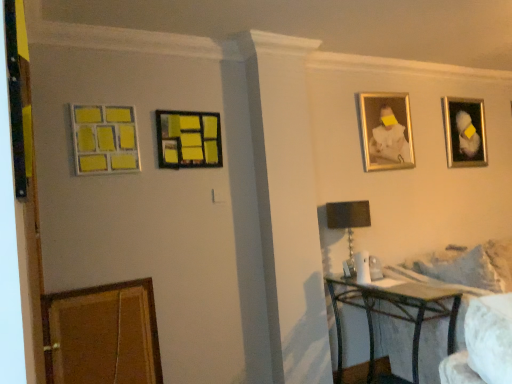
What do you see at coordinates (464, 132) in the screenshot? I see `metallic silver picture frame at upper right, which is the 1th picture frame in back-to-front order` at bounding box center [464, 132].

Find the location of a particular element. metallic silver picture frame at upper right, which is the 1th picture frame in back-to-front order is located at coordinates (464, 132).

You are a GUI agent. You are given a task and a screenshot of the screen. Output one action in this format:
    pyautogui.click(x=<x>, y=<y>)
    Task: Click on the yellow matte picture frame at upper left, marked as the first picture frame in a front-to-back arrangement
    
    Given the screenshot: What is the action you would take?
    pyautogui.click(x=104, y=139)

Measure the distance between point (430, 280) and camera.

Point (430, 280) is 8.24 feet from camera.

This screenshot has width=512, height=384. Identify the location of matte black table lamp at lower right. (348, 224).

This screenshot has width=512, height=384. What do you see at coordinates (394, 313) in the screenshot?
I see `metallic black table at lower right` at bounding box center [394, 313].

Locate an element on the screen. Image resolution: width=512 pixels, height=384 pixels. metallic silver picture frame at upper right, which ranks as the 4th picture frame in left-to-right order is located at coordinates (464, 132).

The width and height of the screenshot is (512, 384). I want to click on table that appears below the white fluffy pillow at right (from a real-world perspective), so click(394, 313).

From a real-world perspective, who is located higher, metallic black table at lower right or white fluffy pillow at right?

white fluffy pillow at right is physically above.

Between metallic black table at lower right and white fluffy pillow at right, which one has smaller size?

With smaller size is white fluffy pillow at right.

Can you confirm if metallic black table at lower right is positioned to the right of white fluffy pillow at right?

No.

Looking at this image, is white fabric couch at lower right aimed at white fluffy pillow at right?

Yes.

Identify the location of pillow that is under the white fabric couch at lower right (from a real-world perspective). (501, 259).

Can you tell me how much white fabric couch at lower right and white fluffy pillow at right differ in facing direction?

The facing directions of white fabric couch at lower right and white fluffy pillow at right are 83.3 degrees apart.

Does point (458, 348) appear closer or farther from the camera than point (492, 240)?

Point (458, 348) appears to be closer to the viewer than point (492, 240).

From their relative heights in the image, would you say white fabric couch at lower right is taller or shorter than metallic silver picture frame at upper right, which is the 1th picture frame in back-to-front order?

In the image, white fabric couch at lower right appears to be shorter than metallic silver picture frame at upper right, which is the 1th picture frame in back-to-front order.

Choose the correct answer: Is white fabric couch at lower right inside metallic silver picture frame at upper right, the 1th picture frame positioned from the right, or outside it?

The correct answer is: outside.

Is white fabric couch at lower right beside metallic silver picture frame at upper right, which ranks as the 4th picture frame in left-to-right order?

white fabric couch at lower right and metallic silver picture frame at upper right, which ranks as the 4th picture frame in left-to-right order, are clearly separated.

Consider the image. Which is more distant, (486, 258) or (465, 153)?

The point (465, 153) is farther from the camera.

Does white fluffy pillow at right have a lesser height compared to metallic silver picture frame at upper right, which is the 1th picture frame in back-to-front order?

Correct, white fluffy pillow at right is not as tall as metallic silver picture frame at upper right, which is the 1th picture frame in back-to-front order.

Is white fluffy pillow at right to the left of metallic silver picture frame at upper right, the 1th picture frame positioned from the right, from the viewer's perspective?

No.

Is point (496, 263) positioned before point (471, 159)?

Yes, point (496, 263) is closer to viewer.

In terms of width, does white fluffy pillow at right look wider or thinner when compared to metallic silver picture frame at upper right, which ranks as the 4th picture frame in left-to-right order?

Considering their sizes, white fluffy pillow at right looks broader than metallic silver picture frame at upper right, which ranks as the 4th picture frame in left-to-right order.

Is matte plastic picture frame at center, which is the third picture frame from back to front, inside the boundaries of metallic black table at lower right, or outside?

matte plastic picture frame at center, which is the third picture frame from back to front, is not enclosed by metallic black table at lower right.

Can you confirm if matte plastic picture frame at center, which is the third picture frame from back to front, is smaller than metallic black table at lower right?

Indeed, matte plastic picture frame at center, which is the third picture frame from back to front, has a smaller size compared to metallic black table at lower right.

Is matte plastic picture frame at center, positioned as the 2th picture frame in front-to-back order, in contact with metallic black table at lower right?

matte plastic picture frame at center, positioned as the 2th picture frame in front-to-back order, is not next to metallic black table at lower right, and they're not touching.

Does metallic silver picture frame at upper right, the 1th picture frame positioned from the right, have a smaller size compared to gold metallic picture frame at upper right, the 2th picture frame viewed from the right?

No.

Is metallic silver picture frame at upper right, the 1th picture frame positioned from the right, not close to gold metallic picture frame at upper right, the third picture frame positioned from the front?

No, metallic silver picture frame at upper right, the 1th picture frame positioned from the right, is not far from gold metallic picture frame at upper right, the third picture frame positioned from the front.

Consider the image. From the image's perspective, is metallic silver picture frame at upper right, which ranks as the 4th picture frame in left-to-right order, located above or below gold metallic picture frame at upper right, the 2th picture frame viewed from the right?

From the image's perspective, metallic silver picture frame at upper right, which ranks as the 4th picture frame in left-to-right order, appears above gold metallic picture frame at upper right, the 2th picture frame viewed from the right.

Between metallic black table at lower right and metallic silver picture frame at upper right, which ranks as the 4th picture frame in left-to-right order, which one appears on the left side from the viewer's perspective?

metallic black table at lower right is more to the left.

Is metallic black table at lower right inside or outside of metallic silver picture frame at upper right, which is the fourth picture frame in front-to-back order?

The correct answer is: outside.

From the image's perspective, which object appears higher, metallic black table at lower right or metallic silver picture frame at upper right, which is the fourth picture frame in front-to-back order?

metallic silver picture frame at upper right, which is the fourth picture frame in front-to-back order, from the image's perspective.

Who is bigger, metallic black table at lower right or metallic silver picture frame at upper right, the 1th picture frame positioned from the right?

metallic black table at lower right.

The width and height of the screenshot is (512, 384). In order to click on table below the white fluffy pillow at right (from the image's perspective) in this screenshot , I will do [394, 313].

Locate an element on the screen. The image size is (512, 384). pillow located underneath the white fabric couch at lower right (from a real-world perspective) is located at coordinates (501, 259).

Considering their positions, is metallic black table at lower right positioned closer to matte black table lamp at lower right than yellow matte picture frame at upper left, which is the 4th picture frame from right to left?

Among the two, metallic black table at lower right is located nearer to matte black table lamp at lower right.

From the image, which object appears to be nearer to matte black table lamp at lower right, matte plastic picture frame at center, positioned as the 2th picture frame in front-to-back order, or gold metallic picture frame at upper right, the third picture frame positioned from the front?

gold metallic picture frame at upper right, the third picture frame positioned from the front, lies closer to matte black table lamp at lower right than the other object.

Based on their spatial positions, is matte black table lamp at lower right or yellow matte picture frame at upper left, which is the 1th picture frame from left to right, further from gold metallic picture frame at upper right, the third picture frame positioned from the front?

Based on the image, yellow matte picture frame at upper left, which is the 1th picture frame from left to right, appears to be further to gold metallic picture frame at upper right, the third picture frame positioned from the front.

Looking at the image, which one is located closer to yellow matte picture frame at upper left, which is the 1th picture frame from left to right, gold metallic picture frame at upper right, the third picture frame in the left-to-right sequence, or matte black table lamp at lower right?

matte black table lamp at lower right.

Based on their spatial positions, is metallic black table at lower right or matte black table lamp at lower right further from metallic silver picture frame at upper right, the 1th picture frame positioned from the right?

metallic black table at lower right.

When comparing their distances from metallic silver picture frame at upper right, which ranks as the 4th picture frame in left-to-right order, does yellow matte picture frame at upper left, marked as the first picture frame in a front-to-back arrangement, or white fabric couch at lower right seem closer?

white fabric couch at lower right lies closer to metallic silver picture frame at upper right, which ranks as the 4th picture frame in left-to-right order, than the other object.

Estimate the real-world distances between objects in this image. Which object is closer to metallic silver picture frame at upper right, which is the fourth picture frame in front-to-back order, matte black table lamp at lower right or matte plastic picture frame at center, acting as the third picture frame starting from the right?

matte black table lamp at lower right lies closer to metallic silver picture frame at upper right, which is the fourth picture frame in front-to-back order, than the other object.

Which object lies nearer to the anchor point yellow matte picture frame at upper left, which is the 4th picture frame from right to left, white fluffy pillow at right or white fabric couch at lower right?

white fabric couch at lower right is positioned closer to the anchor yellow matte picture frame at upper left, which is the 4th picture frame from right to left.

Find the location of a particular element. Image resolution: width=512 pixels, height=384 pixels. table lamp between matte plastic picture frame at center, positioned as the 2th picture frame in front-to-back order, and gold metallic picture frame at upper right, the 2th picture frame when ordered from back to front is located at coordinates (348, 224).

I want to click on table lamp between matte plastic picture frame at center, acting as the third picture frame starting from the right, and metallic silver picture frame at upper right, the 1th picture frame positioned from the right, so click(x=348, y=224).

I want to click on table lamp located between yellow matte picture frame at upper left, which is the 4th picture frame from right to left, and metallic black table at lower right in the left-right direction, so click(348, 224).

Where is `table between matte plastic picture frame at center, which is the third picture frame from back to front, and metallic silver picture frame at upper right, which is the 1th picture frame in back-to-front order, in the horizontal direction`? The height and width of the screenshot is (384, 512). table between matte plastic picture frame at center, which is the third picture frame from back to front, and metallic silver picture frame at upper right, which is the 1th picture frame in back-to-front order, in the horizontal direction is located at coordinates (394, 313).